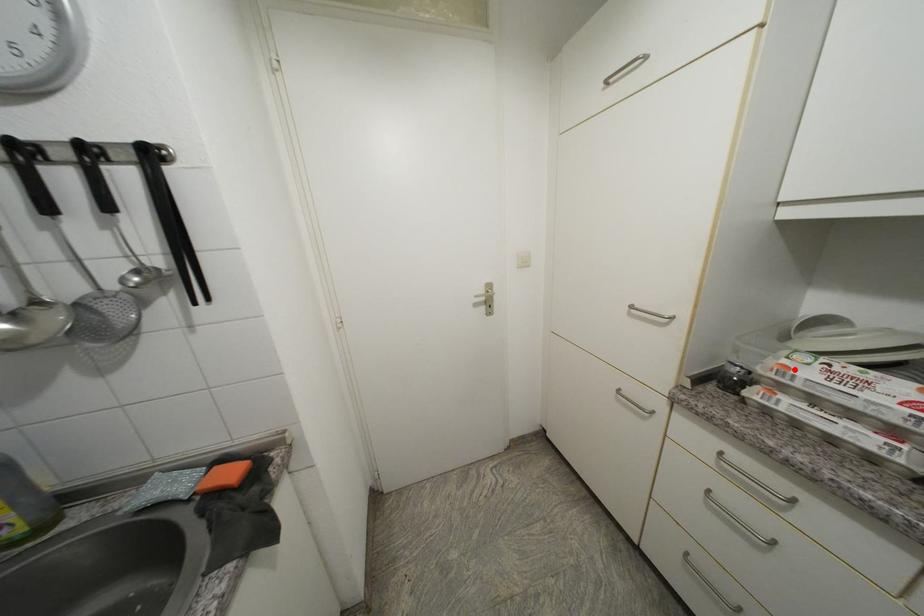
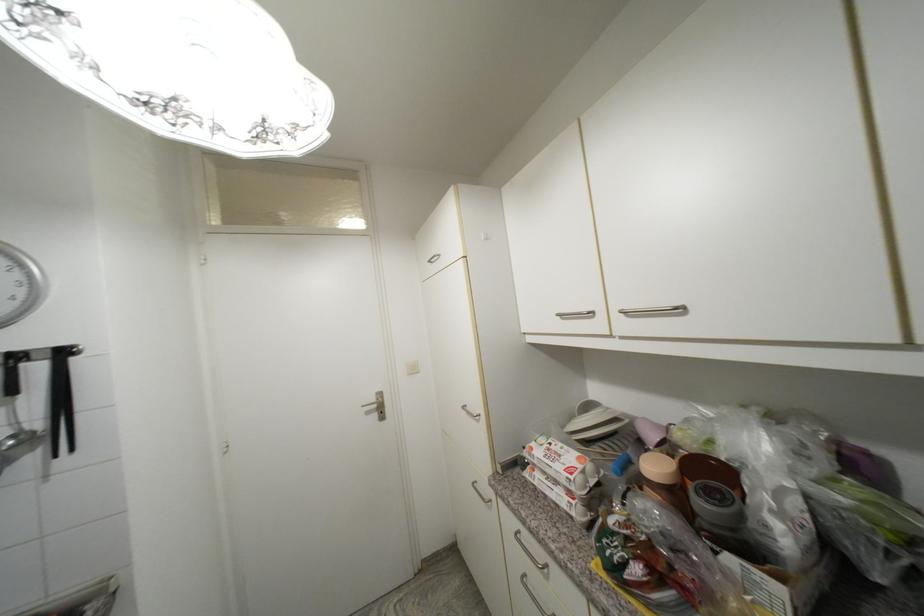
The point at the highlighted location is marked in the first image. Where is the corresponding point in the second image?

(537, 451)